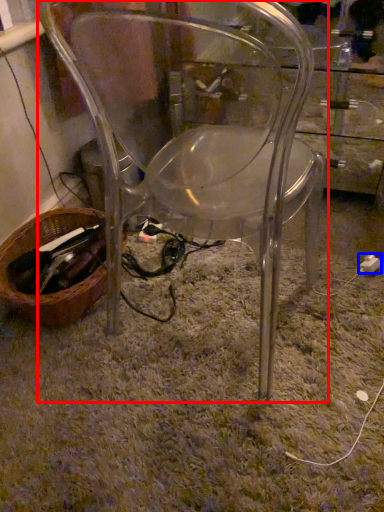
Question: Which point is further to the camera, chair (highlighted by a red box) or plug (highlighted by a blue box)?

Choices:
 (A) chair
 (B) plug

Answer: (B)